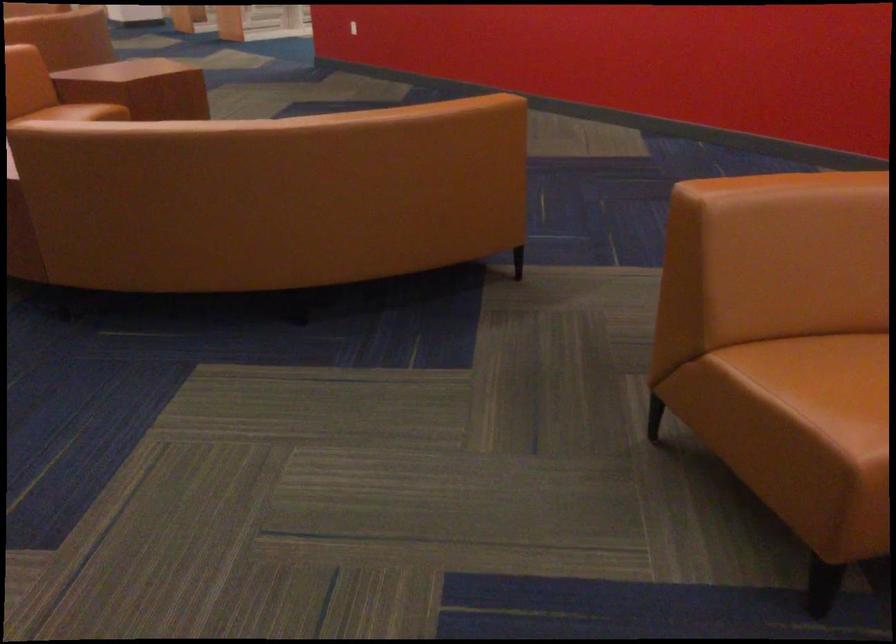
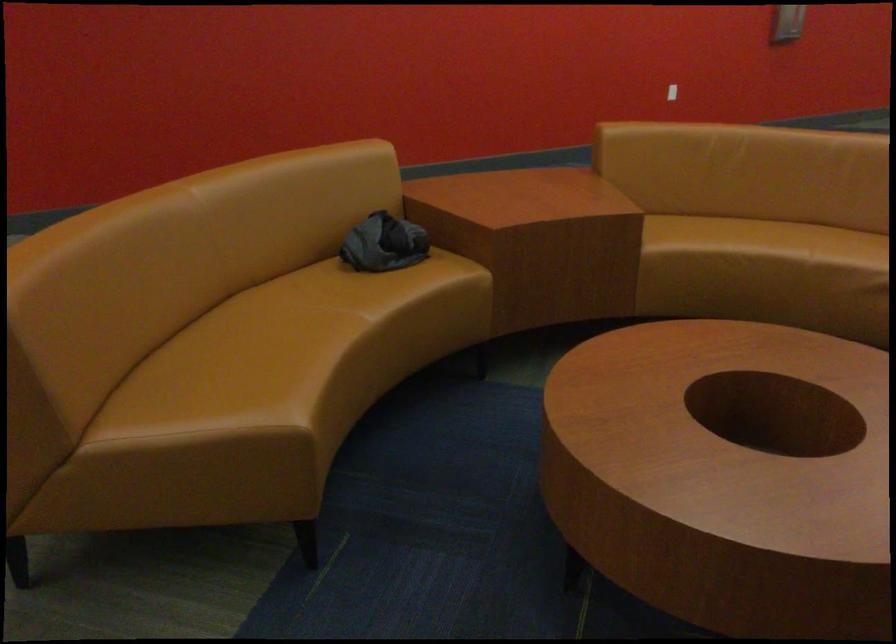
Question: Based on the continuous images, in which direction is the camera rotating? Reply with the corresponding letter.

Choices:
 (A) Left
 (B) Right
 (C) Up
 (D) Down

Answer: (B)